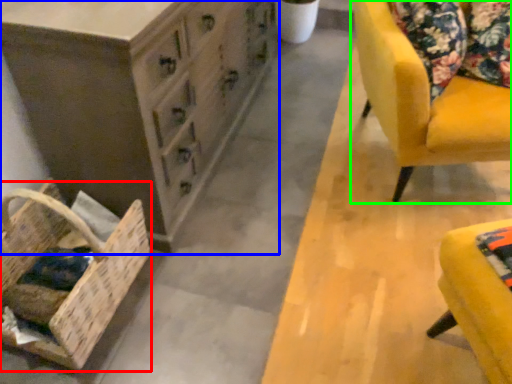
Question: Considering the real-world distances, which object is farthest from basket (highlighted by a red box)? chest of drawers (highlighted by a blue box) or chair (highlighted by a green box)?

Choices:
 (A) chest of drawers
 (B) chair

Answer: (B)